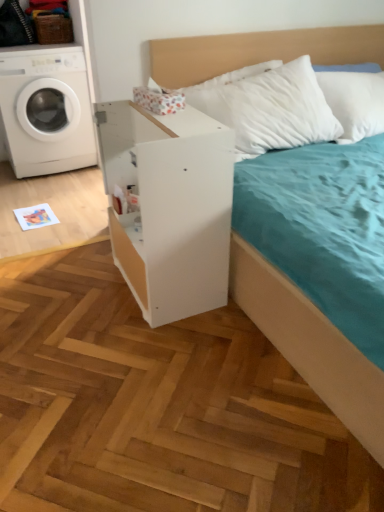
Question: Is white glossy washing machine at left a part of white matte dresser at center?

Choices:
 (A) no
 (B) yes

Answer: (A)

Question: Is white matte dresser at center shorter than white glossy washing machine at left?

Choices:
 (A) yes
 (B) no

Answer: (A)

Question: Does white matte dresser at center come behind white glossy washing machine at left?

Choices:
 (A) no
 (B) yes

Answer: (A)

Question: Is white matte dresser at center to the right of white glossy washing machine at left from the viewer's perspective?

Choices:
 (A) no
 (B) yes

Answer: (B)

Question: From the image's perspective, does white matte dresser at center appear lower than white glossy washing machine at left?

Choices:
 (A) no
 (B) yes

Answer: (B)

Question: Considering the relative sizes of white matte dresser at center and white glossy washing machine at left in the image provided, is white matte dresser at center thinner than white glossy washing machine at left?

Choices:
 (A) yes
 (B) no

Answer: (A)

Question: Is white glossy washing machine at left behind white matte dresser at center?

Choices:
 (A) yes
 (B) no

Answer: (A)

Question: From the image's perspective, is white glossy washing machine at left under white matte dresser at center?

Choices:
 (A) yes
 (B) no

Answer: (B)

Question: Does white glossy washing machine at left have a lesser width compared to white matte dresser at center?

Choices:
 (A) yes
 (B) no

Answer: (B)

Question: Are white glossy washing machine at left and white matte dresser at center far apart?

Choices:
 (A) no
 (B) yes

Answer: (B)

Question: Is white glossy washing machine at left bigger than white matte dresser at center?

Choices:
 (A) yes
 (B) no

Answer: (A)

Question: Is white glossy washing machine at left wider than white matte dresser at center?

Choices:
 (A) yes
 (B) no

Answer: (A)

Question: Considering the positions of white glossy washing machine at left and white matte dresser at center in the image, is white glossy washing machine at left wider or thinner than white matte dresser at center?

Choices:
 (A) wide
 (B) thin

Answer: (A)